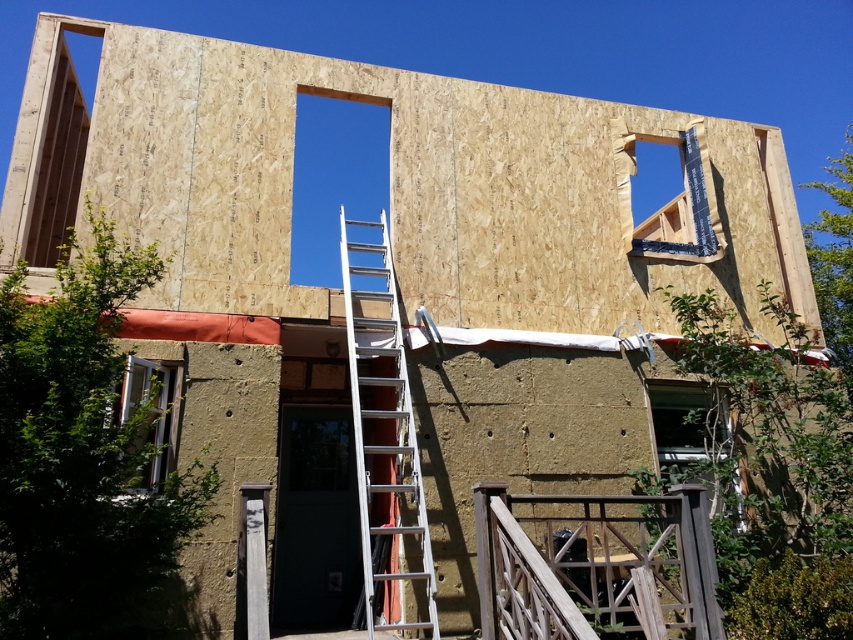
Question: Can you confirm if natural wood siding at upper center is positioned above clear glass window at lower right?

Choices:
 (A) yes
 (B) no

Answer: (A)

Question: Among these points, which one is nearest to the camera?

Choices:
 (A) (692, 220)
 (B) (704, 433)

Answer: (B)

Question: Is clear glass window at upper center to the right of clear glass window at lower left from the viewer's perspective?

Choices:
 (A) no
 (B) yes

Answer: (B)

Question: Estimate the real-world distances between objects in this image. Which object is farther from the clear glass window at lower left?

Choices:
 (A) clear glass window at lower right
 (B) natural wood siding at upper center

Answer: (A)

Question: Which of the following is the closest to the observer?

Choices:
 (A) (155, 141)
 (B) (142, 468)
 (C) (701, 240)
 (D) (364, 621)

Answer: (B)

Question: In this image, where is clear glass window at lower right located relative to clear glass window at upper center?

Choices:
 (A) below
 (B) above

Answer: (A)